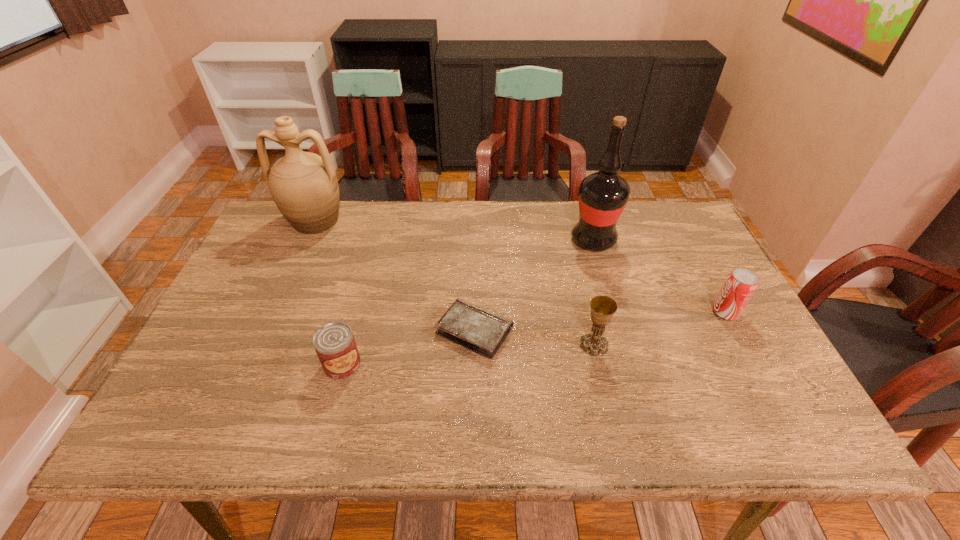
I want to click on vacant space that is in between the wine bottle and the chalice, so click(x=593, y=293).

Where is `vacant region between the diary and the chalice`? The image size is (960, 540). vacant region between the diary and the chalice is located at coordinates (534, 338).

In order to click on empty location between the shortest object and the chalice in this screenshot , I will do `click(534, 338)`.

The height and width of the screenshot is (540, 960). What are the coordinates of `vacant area between the pitcher and the wine bottle` in the screenshot? It's located at (454, 231).

This screenshot has width=960, height=540. Find the location of `free point between the fifth object from right to left and the pitcher`. free point between the fifth object from right to left and the pitcher is located at coordinates point(328,293).

I want to click on object that ranks as the closest to the shortest object, so click(x=603, y=308).

You are a GUI agent. You are given a task and a screenshot of the screen. Output one action in this format:
    pyautogui.click(x=<x>, y=<y>)
    Task: Click on the fourth closest object to the diary
    
    Given the screenshot: What is the action you would take?
    pyautogui.click(x=303, y=185)

Where is `vacant space that satisfies the following two spatial constraints: 1. on the logo side of the soda can; 2. on the front side of the fifth object from right to left`? vacant space that satisfies the following two spatial constraints: 1. on the logo side of the soda can; 2. on the front side of the fifth object from right to left is located at coordinates (753, 364).

In order to click on free space that satisfies the following two spatial constraints: 1. on the back side of the wine bottle; 2. on the right side of the shortest object in this screenshot , I will do `click(475, 240)`.

Where is `free spot that satisfies the following two spatial constraints: 1. on the front side of the second shortest object; 2. on the right side of the leftmost object`? free spot that satisfies the following two spatial constraints: 1. on the front side of the second shortest object; 2. on the right side of the leftmost object is located at coordinates (251, 364).